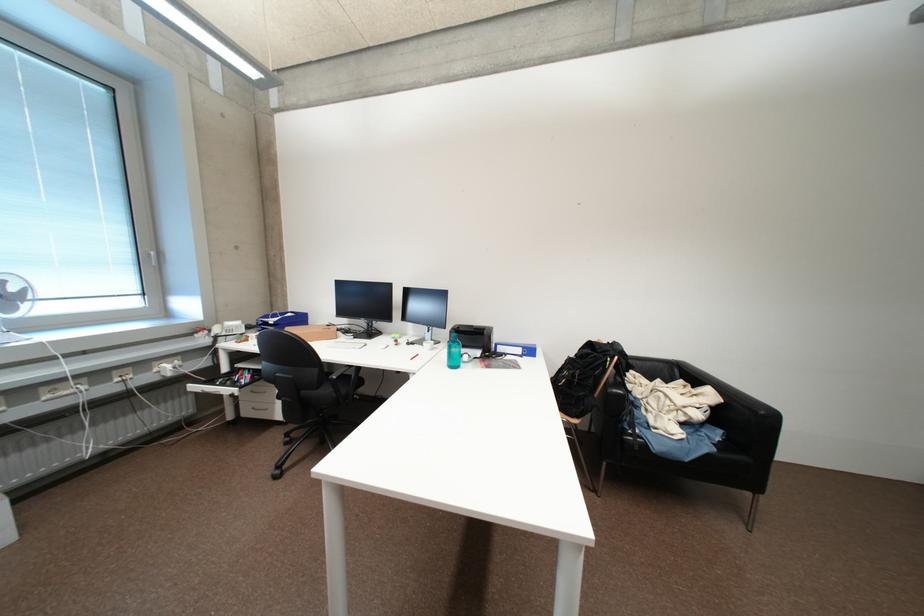
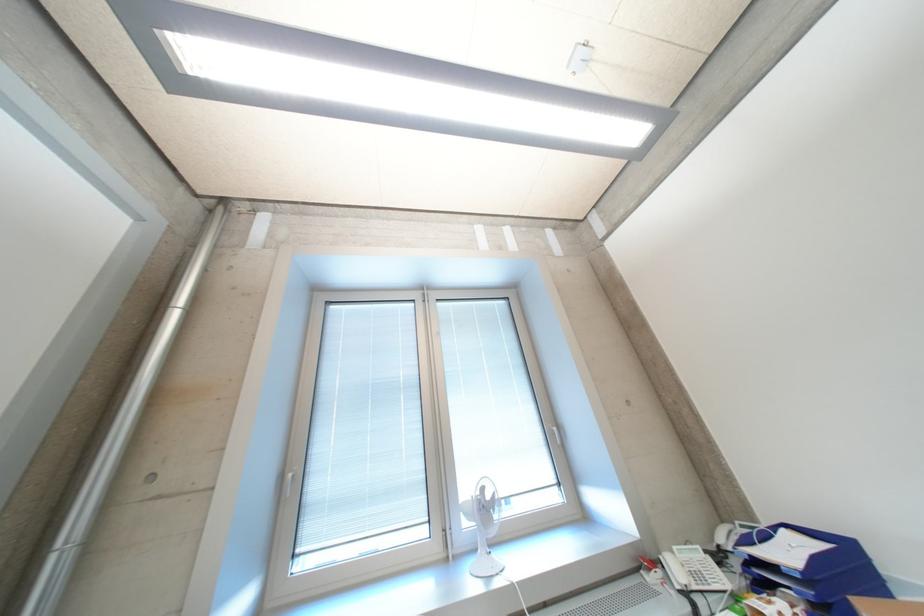
Where in the second image is the point corresponding to point 225,339 from the first image?

(696, 597)